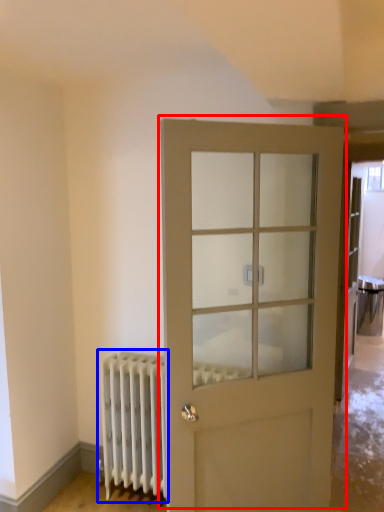
Question: Which object appears closest to the camera in this image, door (highlighted by a red box) or radiator (highlighted by a blue box)?

Choices:
 (A) door
 (B) radiator

Answer: (A)